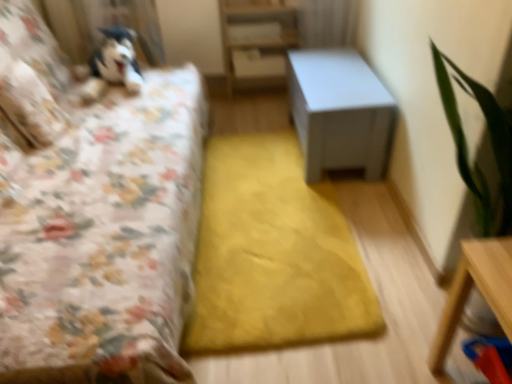
Question: Considering the relative positions of floral fabric bed at left and white matte bookshelf at center in the image provided, is floral fabric bed at left behind white matte bookshelf at center?

Choices:
 (A) no
 (B) yes

Answer: (A)

Question: Does floral fabric bed at left have a smaller size compared to white matte bookshelf at center?

Choices:
 (A) yes
 (B) no

Answer: (B)

Question: Does floral fabric bed at left turn towards white matte bookshelf at center?

Choices:
 (A) yes
 (B) no

Answer: (B)

Question: From the image's perspective, is floral fabric bed at left over white matte bookshelf at center?

Choices:
 (A) yes
 (B) no

Answer: (B)

Question: Is floral fabric bed at left located outside white matte bookshelf at center?

Choices:
 (A) yes
 (B) no

Answer: (A)

Question: Is floral fabric bed at left taller than white matte bookshelf at center?

Choices:
 (A) no
 (B) yes

Answer: (B)

Question: Considering the relative positions of fluffy white pillow at upper left, the 1th pillow in the left-to-right sequence, and floral fabric bed at left in the image provided, is fluffy white pillow at upper left, the 1th pillow in the left-to-right sequence, to the right of floral fabric bed at left from the viewer's perspective?

Choices:
 (A) yes
 (B) no

Answer: (B)

Question: Is fluffy white pillow at upper left, the 1th pillow from the back, wider than floral fabric bed at left?

Choices:
 (A) no
 (B) yes

Answer: (A)

Question: From a real-world perspective, is fluffy white pillow at upper left, the 1th pillow in the left-to-right sequence, located beneath floral fabric bed at left?

Choices:
 (A) yes
 (B) no

Answer: (B)

Question: Is fluffy white pillow at upper left, which ranks as the 2th pillow in front-to-back order, next to floral fabric bed at left?

Choices:
 (A) no
 (B) yes

Answer: (A)

Question: Can we say fluffy white pillow at upper left, the 1th pillow in the left-to-right sequence, lies outside floral fabric bed at left?

Choices:
 (A) yes
 (B) no

Answer: (B)

Question: Is fluffy white pillow at upper left, which is the second pillow in right-to-left order, closer to the viewer compared to floral fabric bed at left?

Choices:
 (A) yes
 (B) no

Answer: (B)

Question: Is fluffy white pillow at upper left, which ranks as the 2th pillow in front-to-back order, further to camera compared to white matte table at center, the second table ordered from the bottom?

Choices:
 (A) no
 (B) yes

Answer: (B)